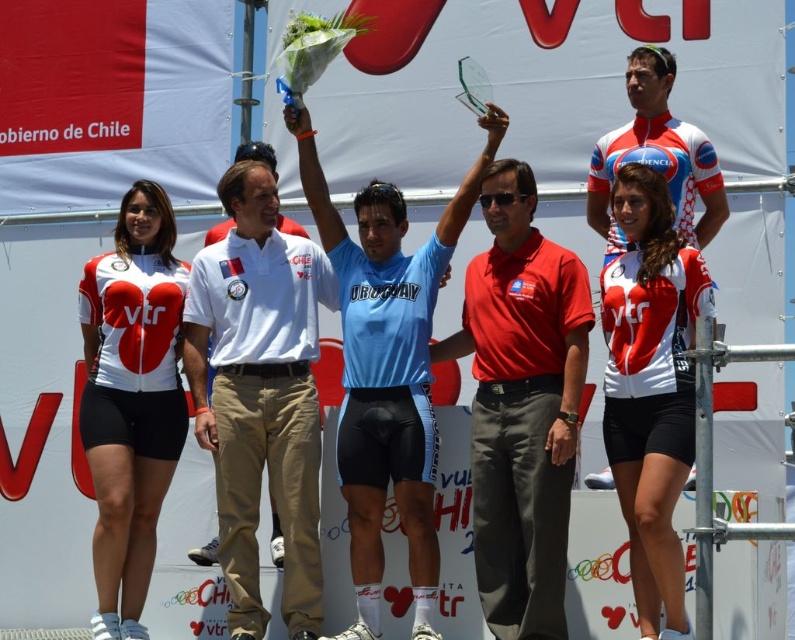
Consider the image. You are a photographer at the event and want to capture a photo that includes both the point at coordinates point (126, 320) and the point at coordinates point (683, 173). Based on their positions, which point is closer to the camera?

Point (126, 320) is behind point (683, 173), so the point at coordinates point (683, 173) is closer to the camera.

You are a photographer at the event and need to ensure both the light blue jersey at center and the matte white jersey at center are visible in your photo. Given their sizes, which jersey should you focus on to ensure both are captured clearly?

The light blue jersey at center is bigger than the matte white jersey at center, so focusing on the larger light blue jersey at center will help ensure both are visible in the photo.

You are a photographer at the event and need to ensure that both the white matte jersey at left and the matte white jersey at center are clearly visible in your photo. Given their sizes, which jersey should you focus on to capture more details?

The white matte jersey at left is bigger than the matte white jersey at center, so focusing on the white matte jersey at left will allow you to capture more details due to its larger size.